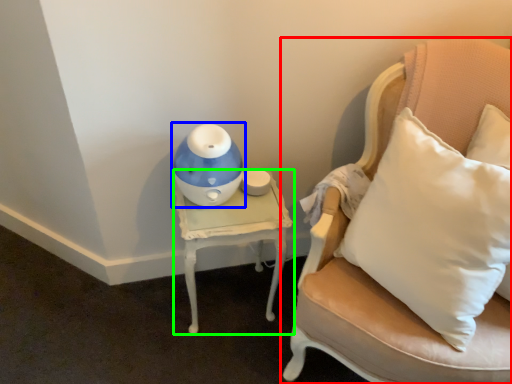
Question: Which object is positioned farthest from chair (highlighted by a red box)? Select from toy (highlighted by a blue box) and table (highlighted by a green box).

Choices:
 (A) toy
 (B) table

Answer: (A)